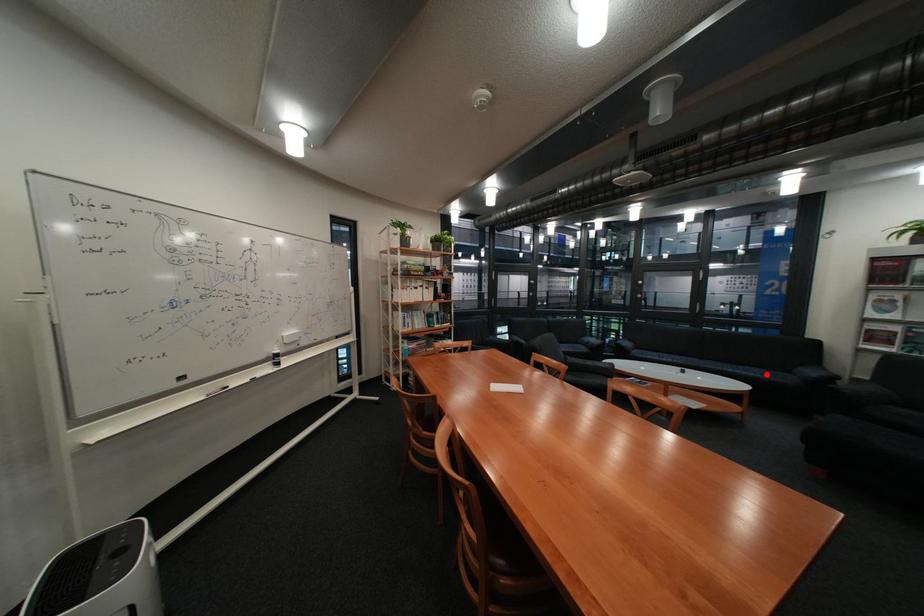
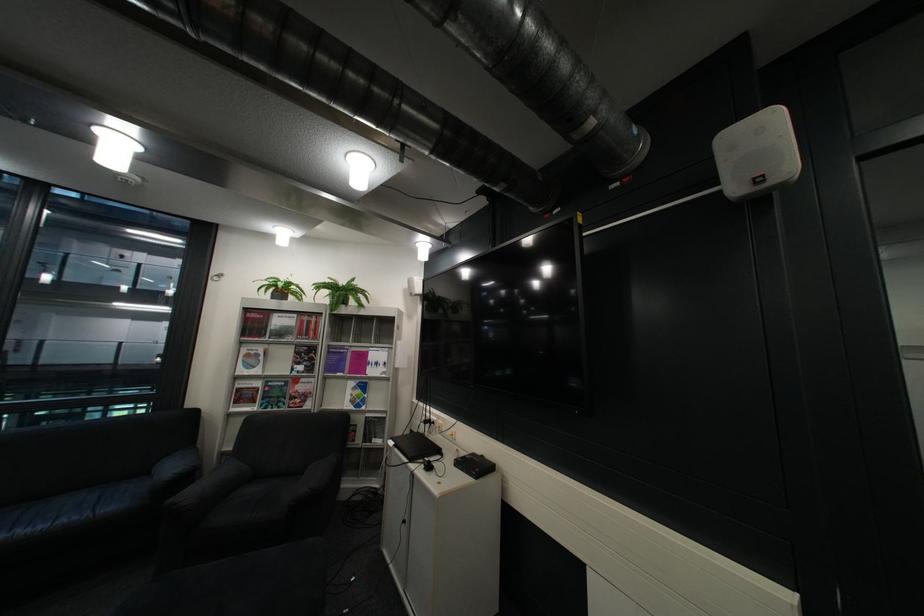
Locate, in the second image, the point that corresponds to the highlighted location in the first image.

(58, 527)